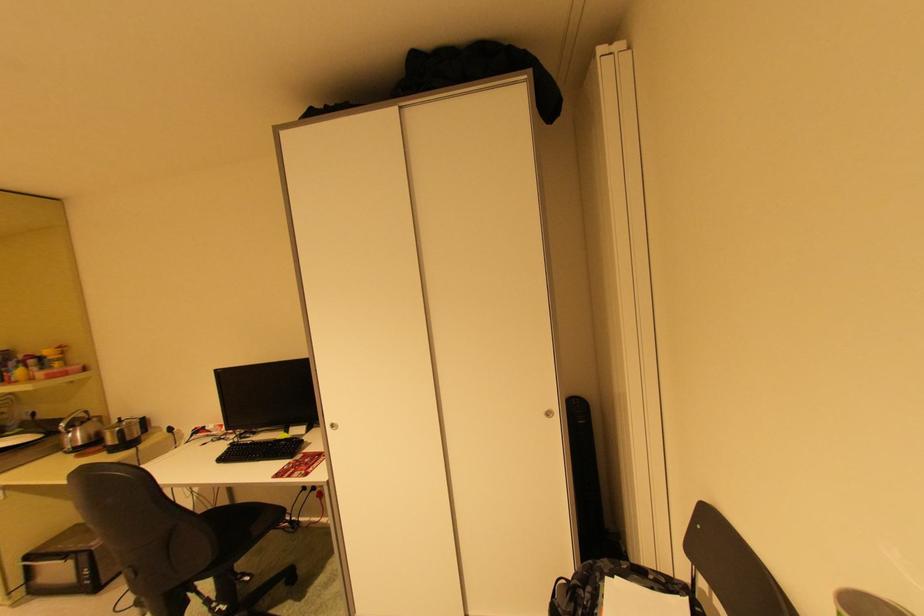
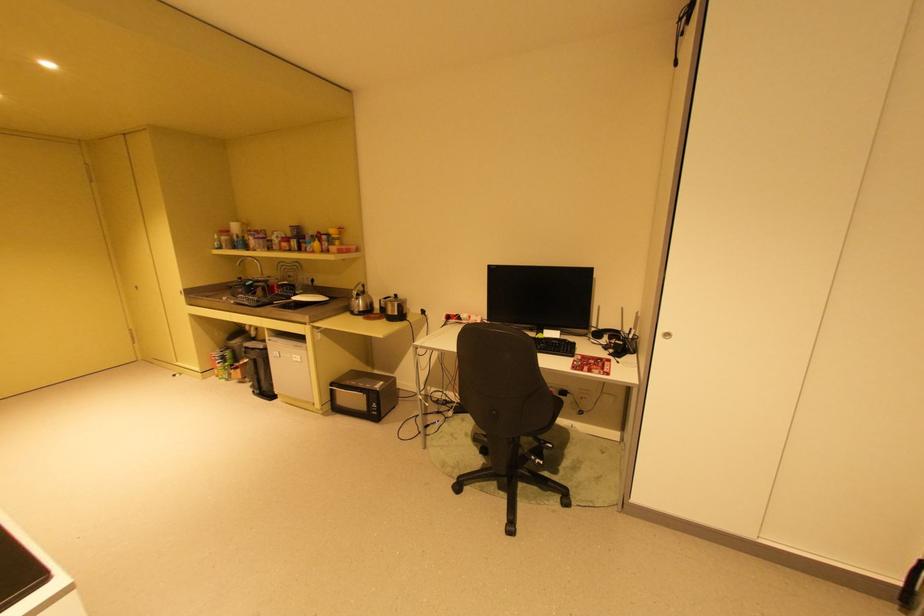
Locate, in the second image, the point that corresponds to [84,525] in the first image.

(359, 371)